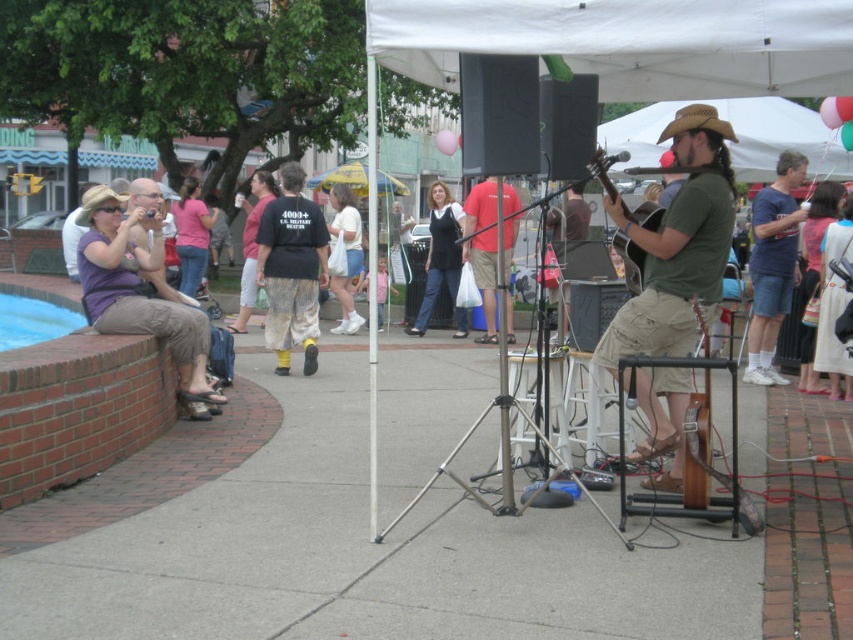
Which is behind, point (445, 241) or point (663, 212)?

Point (445, 241)

Does matte black shirt at center appear on the right side of acoustic guitar at center?

No, matte black shirt at center is not to the right of acoustic guitar at center.

Describe the element at coordinates (440, 259) in the screenshot. I see `matte black shirt at center` at that location.

Where is `matte black shirt at center`? This screenshot has height=640, width=853. matte black shirt at center is located at coordinates (440, 259).

Does black cotton shirt at center have a larger size compared to pink fabric shirt at center?

Incorrect, black cotton shirt at center is not larger than pink fabric shirt at center.

Which is behind, point (326, 234) or point (202, 269)?

The point (202, 269) is more distant.

Locate an element on the screen. This screenshot has width=853, height=640. black cotton shirt at center is located at coordinates (291, 269).

Looking at this image, is purple fabric shirt at left wider than black cotton shirt at center?

Correct, the width of purple fabric shirt at left exceeds that of black cotton shirt at center.

Is purple fabric shirt at left positioned behind black cotton shirt at center?

No, purple fabric shirt at left is in front of black cotton shirt at center.

Is point (155, 291) less distant than point (310, 250)?

That is True.

The width and height of the screenshot is (853, 640). Identify the location of purple fabric shirt at left. (140, 292).